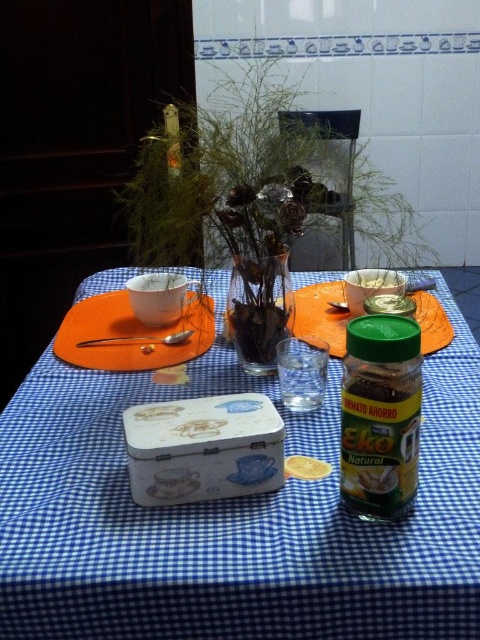
Question: Which object is the closest to the orange felt placemat at center?

Choices:
 (A) green plastic container at center
 (B) silver spoon at left

Answer: (B)

Question: Is green plastic container at center wider than silver spoon at left?

Choices:
 (A) no
 (B) yes

Answer: (B)

Question: Does blue checkered tablecloth at center appear on the right side of silver spoon at left?

Choices:
 (A) no
 (B) yes

Answer: (B)

Question: Can you confirm if green plastic container at center is positioned to the right of silver spoon at left?

Choices:
 (A) yes
 (B) no

Answer: (A)

Question: Among these points, which one is farthest from the camera?

Choices:
 (A) (431, 353)
 (B) (96, 442)
 (C) (233, 193)
 (D) (307, 472)

Answer: (A)

Question: Which is nearer to the yellow powder at center?

Choices:
 (A) translucent glass vase at center
 (B) silver spoon at left
 (C) orange felt placemat at center

Answer: (B)